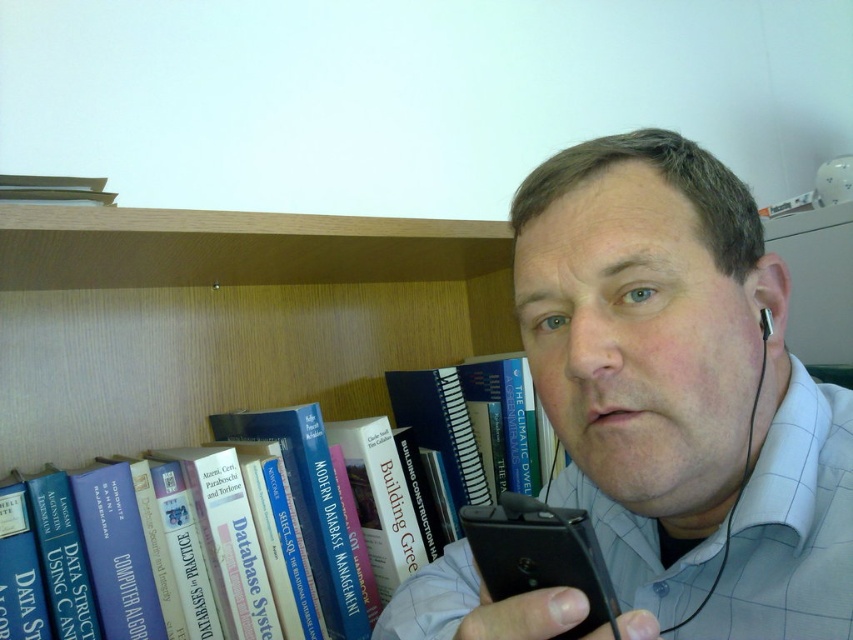
You are a photographer trying to capture a closeup of the man in the image. You want to focus on the point at point (584,401) and point (763,339). Since you can only focus on one point at a time, which point should you choose to ensure the man is in focus?

You should focus on point (584,401) because it is closer to the camera and thus the man will be in focus there.

You are a librarian organizing books on a shelf. You need to place a new book exactly at the coordinates point (184, 541). According to the image, where would this point be located?

The point (184, 541) is on the blue hardcover book at left, so you should place the new book there.

You are a photographer trying to capture a closeup of the matte black phone at center and the black plastic earphone at right. Which object should you focus on first to ensure both are in focus?

The matte black phone at center is closer to the viewer than the black plastic earphone at right, so focus on the matte black phone at center first to ensure both are in focus.